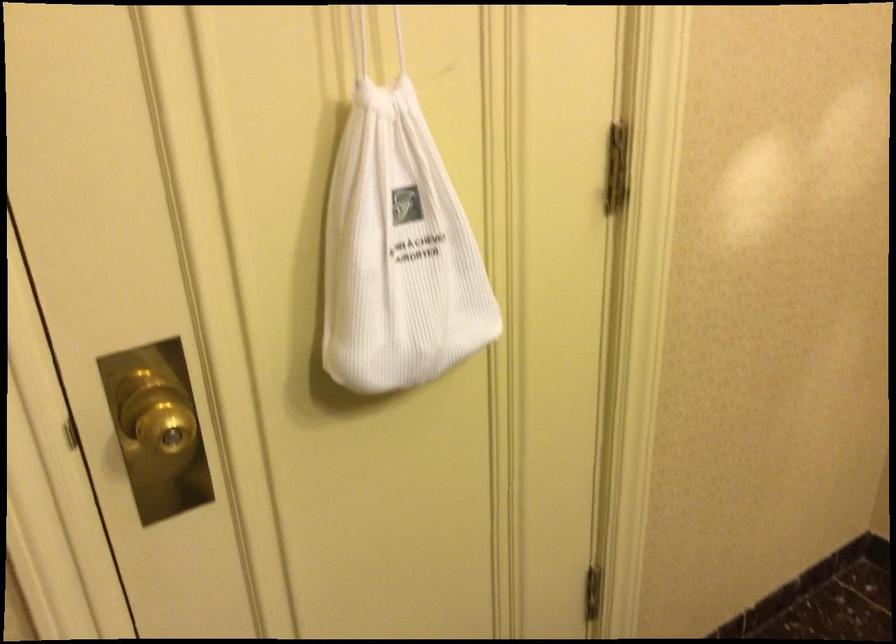
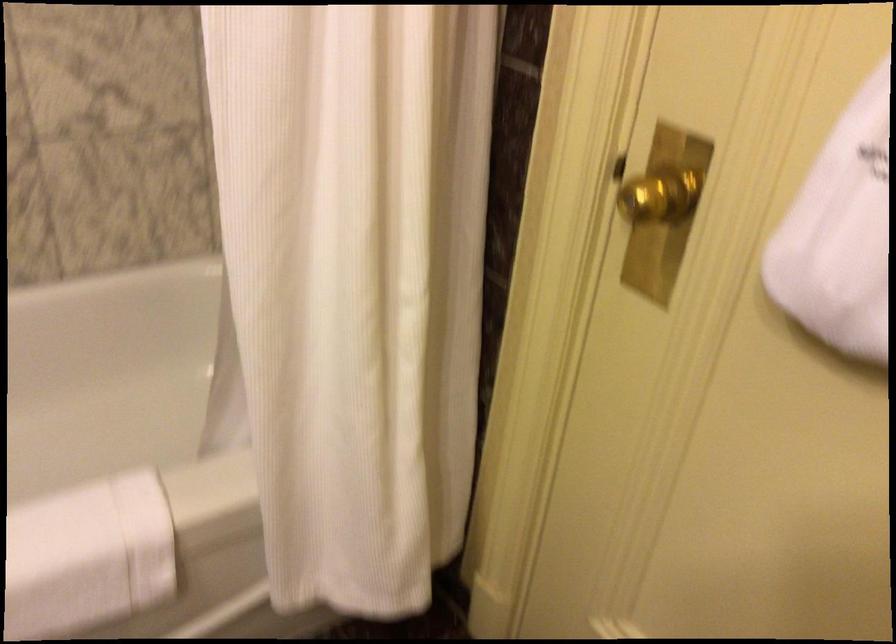
Based on the continuous images, in which direction is the camera rotating?

The camera's rotation is toward left-down.